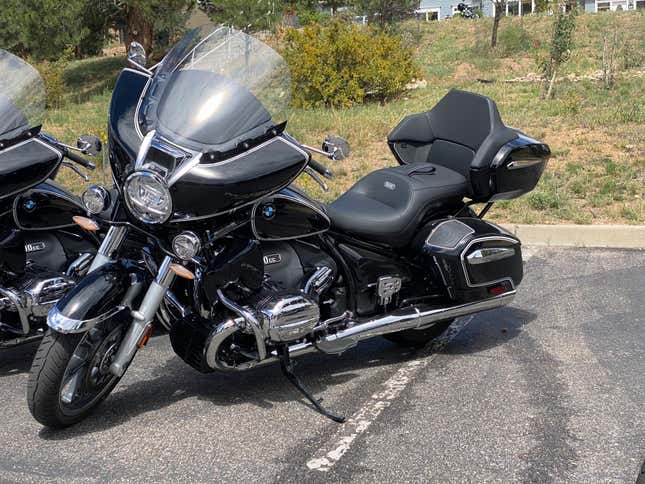
Image resolution: width=645 pixels, height=484 pixels. I want to click on seat, so click(x=421, y=181).